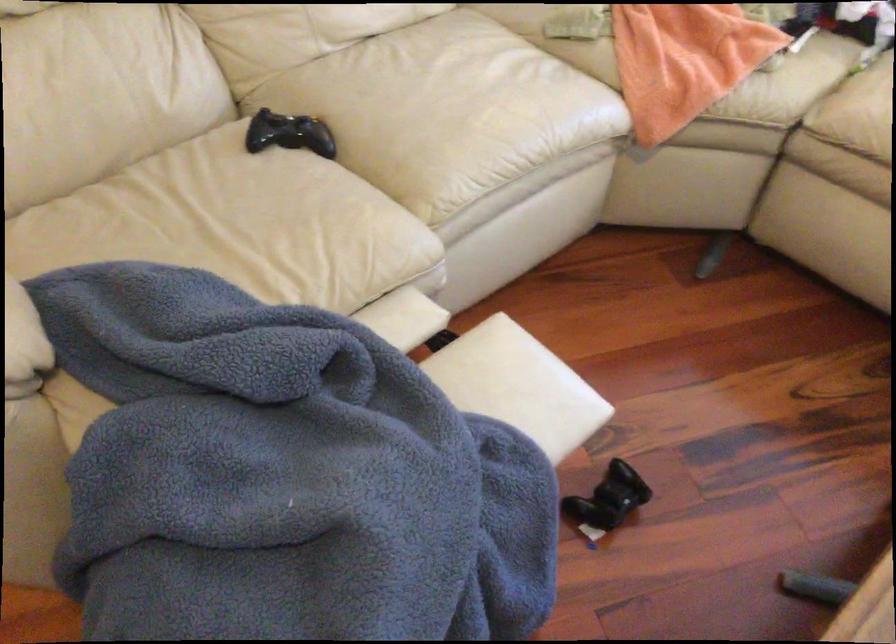
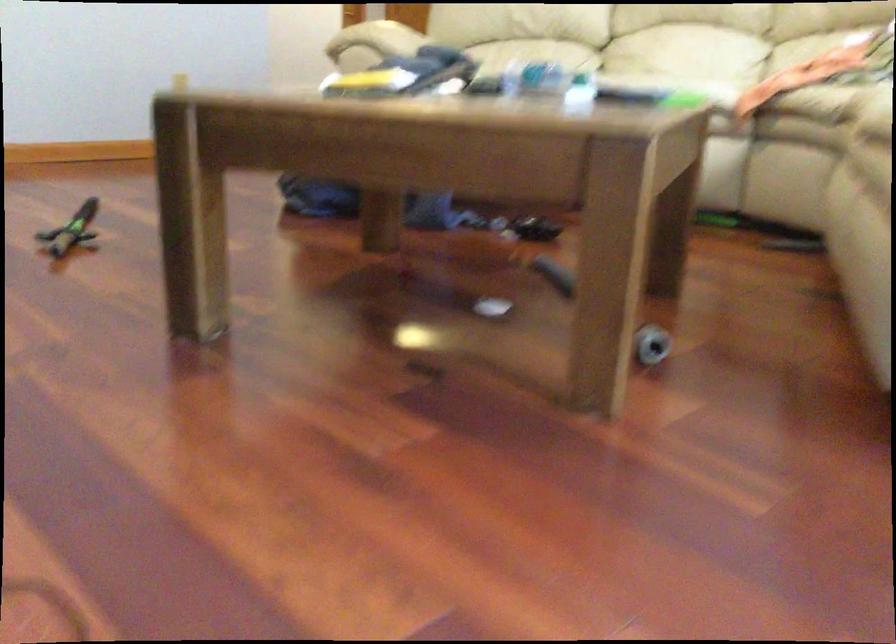
Question: I am providing you with two images of the same scene from different viewpoints. Which of the following objects are not visible in image2?

Choices:
 (A) sofa armrest
 (B) black game controller
 (C) wooden bed frame rail
 (D) clear plastic bottle

Answer: (B)